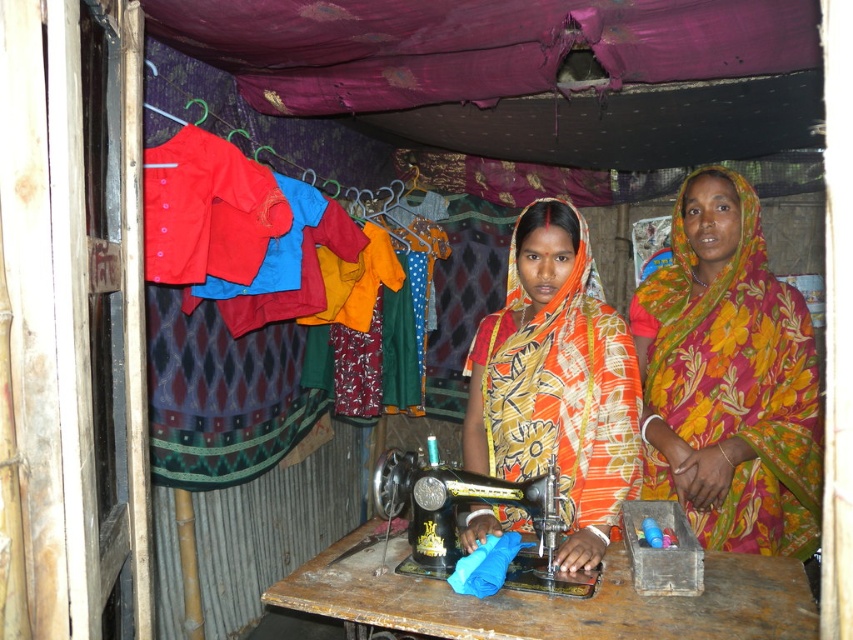
Question: Which of these objects is positioned closest to the black metal sewing machine at center?

Choices:
 (A) floral fabric saree at center
 (B) printed cotton saree at center

Answer: (B)

Question: Is printed cotton saree at center in front of black metal sewing machine at center?

Choices:
 (A) no
 (B) yes

Answer: (A)

Question: Is printed cotton saree at center to the left of black metal sewing machine at center from the viewer's perspective?

Choices:
 (A) no
 (B) yes

Answer: (A)

Question: Is floral fabric saree at center behind black metal sewing machine at center?

Choices:
 (A) yes
 (B) no

Answer: (A)

Question: Which object appears farthest from the camera in this image?

Choices:
 (A) printed cotton saree at center
 (B) floral fabric saree at center

Answer: (B)

Question: Among these objects, which one is farthest from the camera?

Choices:
 (A) printed cotton saree at center
 (B) black metal sewing machine at center

Answer: (A)